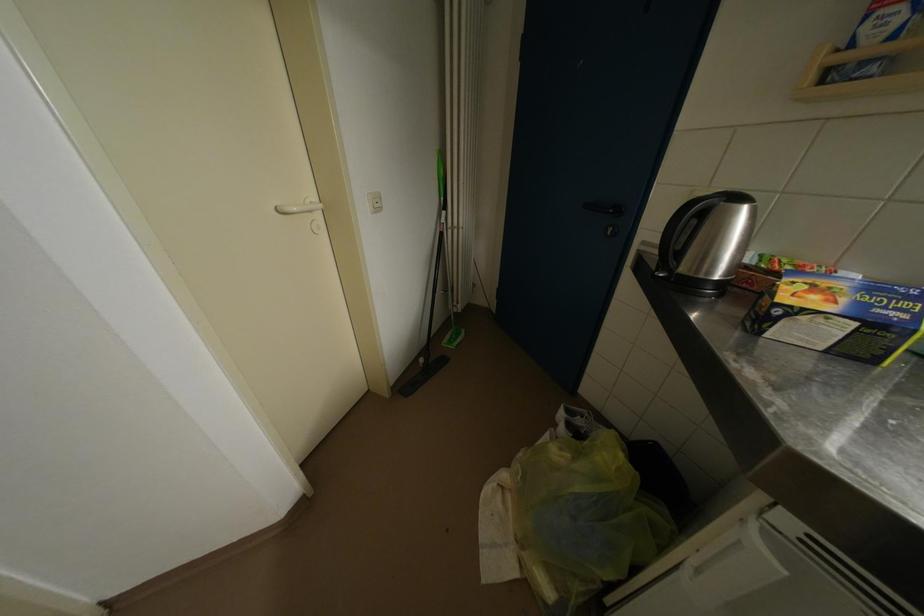
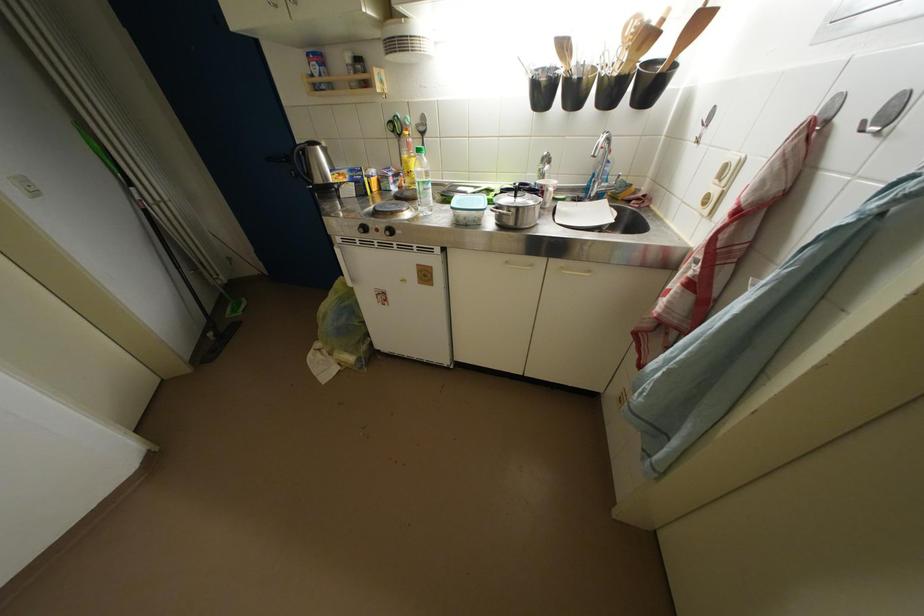
The point at (450, 225) is marked in the first image. Where is the corresponding point in the second image?

(144, 201)